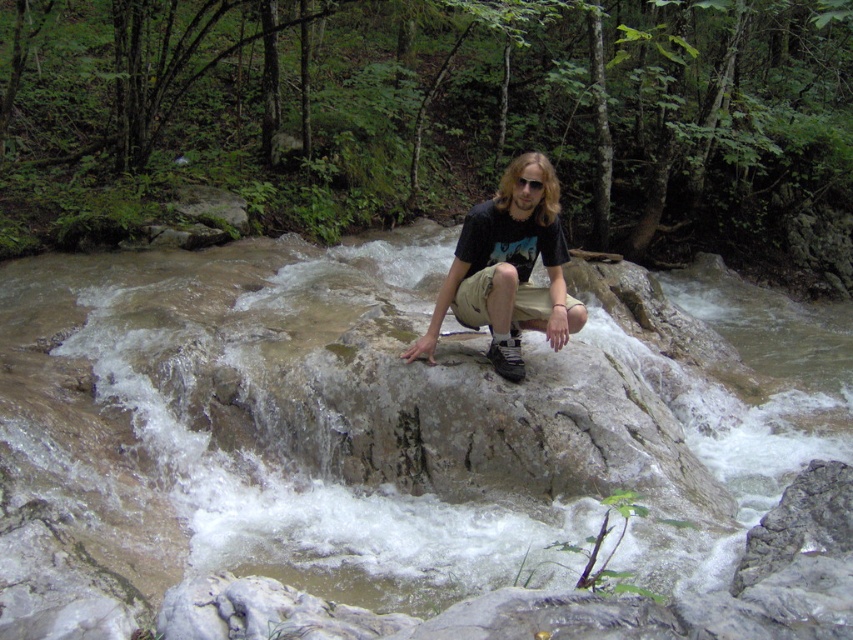
Is clear water at rock center taller than black matte t-shirt at center?

Yes.

Who is shorter, clear water at rock center or black matte t-shirt at center?

black matte t-shirt at center is shorter.

What do you see at coordinates (364, 432) in the screenshot? I see `clear water at rock center` at bounding box center [364, 432].

Where is `clear water at rock center`? The width and height of the screenshot is (853, 640). clear water at rock center is located at coordinates click(364, 432).